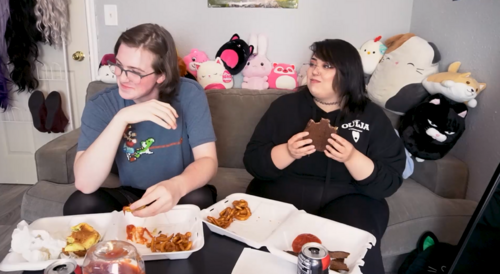
Locate an element on the screen. The width and height of the screenshot is (500, 274). door is located at coordinates (56, 72).